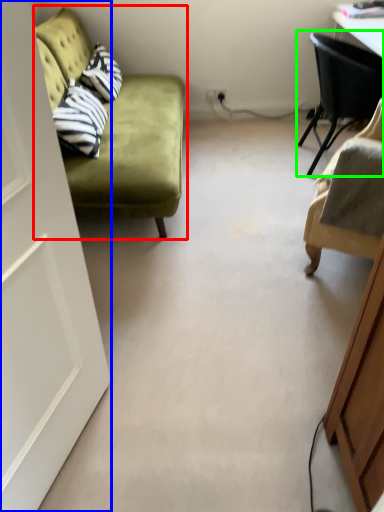
Question: Considering the real-world distances, which object is closest to studio couch (highlighted by a red box)? door (highlighted by a blue box) or chair (highlighted by a green box).

Choices:
 (A) door
 (B) chair

Answer: (B)